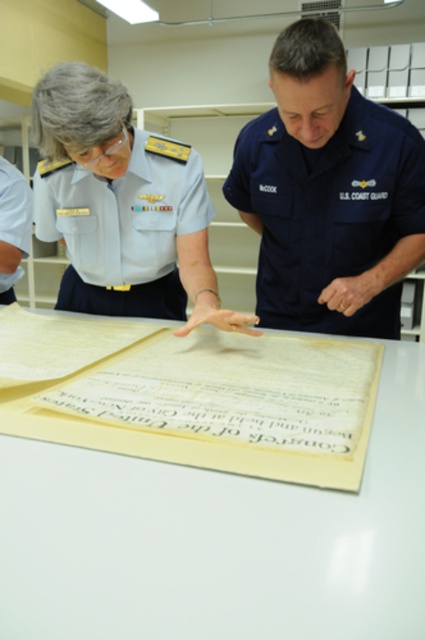
Question: Among these objects, which one is nearest to the camera?

Choices:
 (A) white fabric uniform at upper left
 (B) white glossy uniform at upper left

Answer: (B)

Question: Considering the relative positions of white paper at center and navy blue uniform at center in the image provided, where is white paper at center located with respect to navy blue uniform at center?

Choices:
 (A) right
 (B) left

Answer: (B)

Question: Which point appears farthest from the camera in this image?

Choices:
 (A) (0, 170)
 (B) (342, 164)

Answer: (A)

Question: Can you confirm if white glossy uniform at upper left is thinner than white fabric uniform at upper left?

Choices:
 (A) no
 (B) yes

Answer: (A)

Question: Can you confirm if white glossy uniform at upper left is positioned to the left of white fabric uniform at upper left?

Choices:
 (A) no
 (B) yes

Answer: (A)

Question: Which object is closer to the camera taking this photo?

Choices:
 (A) navy blue uniform at center
 (B) white paper at center
 (C) white fabric uniform at upper left

Answer: (B)